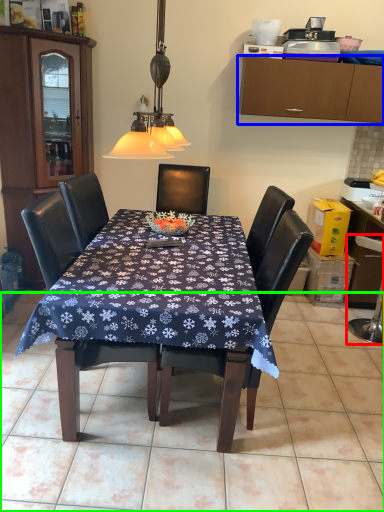
Question: Considering the real-world distances, which object is closest to swivel chair (highlighted by a red box)? cabinetry (highlighted by a blue box) or tile (highlighted by a green box).

Choices:
 (A) cabinetry
 (B) tile

Answer: (B)